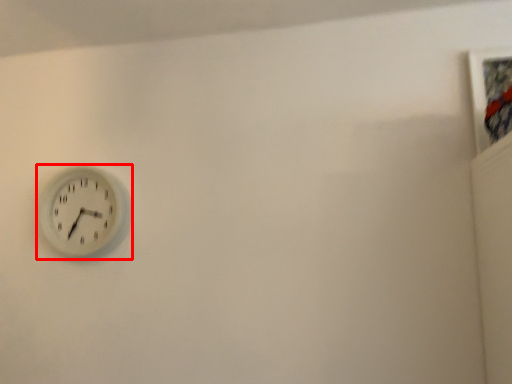
Question: In this image, where is wall clock (annotated by the red box) located relative to picture frame?

Choices:
 (A) right
 (B) left

Answer: (B)